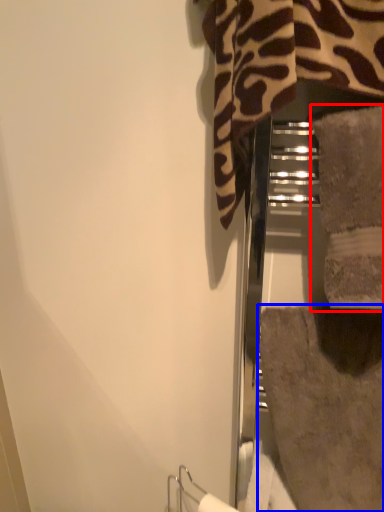
Question: Which of the following is the closest to the observer, towel (highlighted by a red box) or bath towel (highlighted by a blue box)?

Choices:
 (A) towel
 (B) bath towel

Answer: (A)